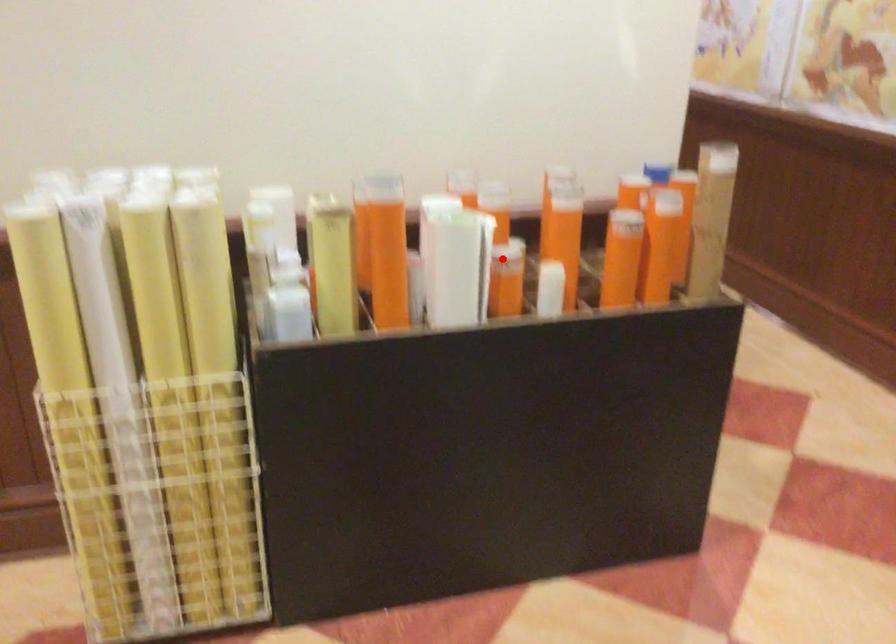
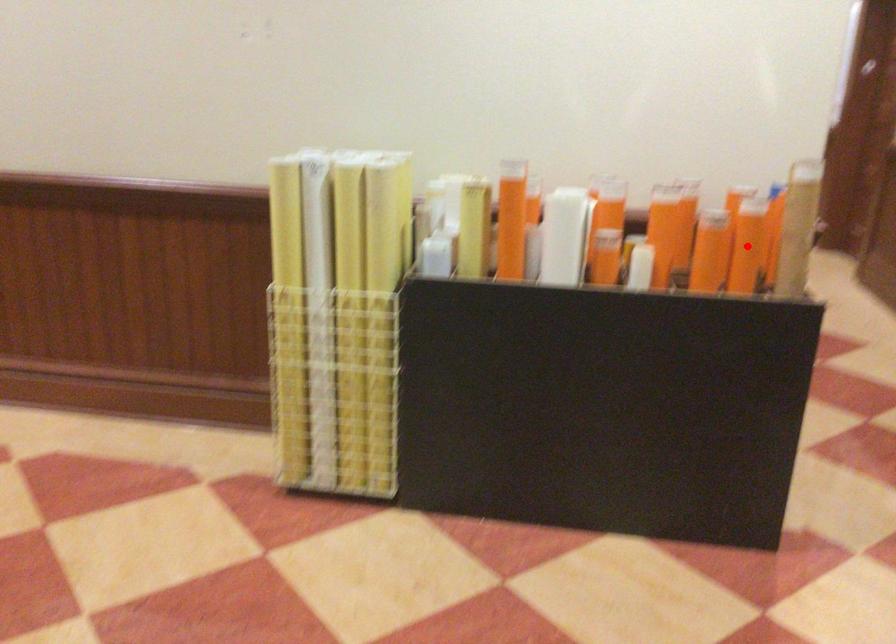
I am providing you with two images of the same scene from different viewpoints. A red point is marked on the first image and another point is marked on the second image. Is the marked point in image1 the same physical position as the marked point in image2?

No